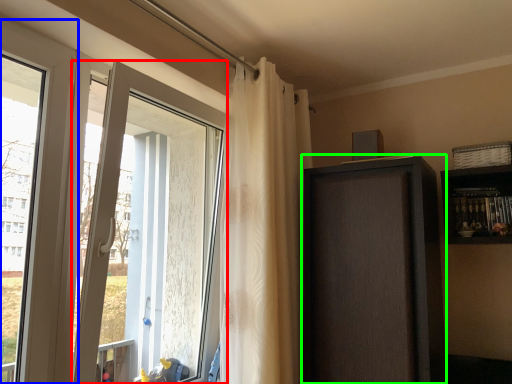
Question: Estimate the real-world distances between objects in this image. Which object is closer to door (highlighted by a red box), window (highlighted by a blue box) or screen door (highlighted by a green box)?

Choices:
 (A) window
 (B) screen door

Answer: (A)